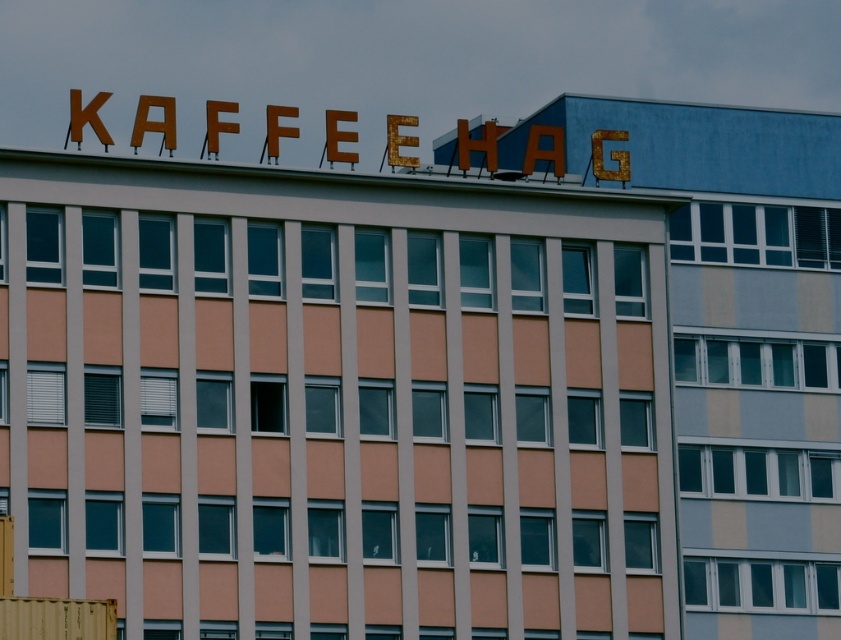
Question: Which of the following is the farthest from the observer?

Choices:
 (A) (812, 262)
 (B) (3, 600)

Answer: (A)

Question: Is the position of rusty metal sign at upper center more distant than that of yellow matte shipping container at lower left?

Choices:
 (A) yes
 (B) no

Answer: (A)

Question: Does rusty metal sign at upper center have a greater width compared to yellow matte shipping container at lower left?

Choices:
 (A) yes
 (B) no

Answer: (A)

Question: Is rusty metal sign at upper center wider than yellow matte shipping container at lower left?

Choices:
 (A) no
 (B) yes

Answer: (B)